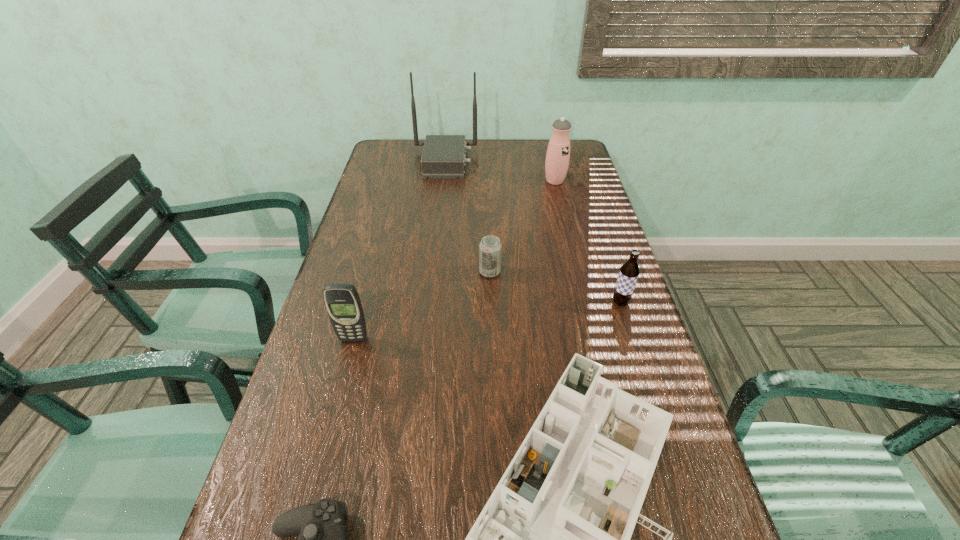
Find the location of a particular element. free space between the fourth nearest object and the second tallest object is located at coordinates (588, 242).

The height and width of the screenshot is (540, 960). What are the coordinates of `free point between the cellular telephone and the soda can` in the screenshot? It's located at (421, 306).

Where is `object that stands as the sixth closest to the router`? This screenshot has height=540, width=960. object that stands as the sixth closest to the router is located at coordinates (323, 539).

Image resolution: width=960 pixels, height=540 pixels. I want to click on object that is the second closest to the third farthest object, so click(553, 539).

The width and height of the screenshot is (960, 540). In order to click on vacant space that satisfies the following two spatial constraints: 1. on the back of the router to connect cables; 2. on the right side of the soda can in this screenshot , I will do `click(432, 272)`.

Identify the location of free region that satisfies the following two spatial constraints: 1. on the back of the fourth nearest object to connect cables; 2. on the left side of the router. (428, 302).

This screenshot has width=960, height=540. I want to click on vacant point that satisfies the following two spatial constraints: 1. on the back of the tallest object to connect cables; 2. on the right side of the third farthest object, so click(x=432, y=272).

Locate an element on the screen. The width and height of the screenshot is (960, 540). vacant region that satisfies the following two spatial constraints: 1. on the back of the tallest object to connect cables; 2. on the left side of the thermos bottle is located at coordinates (443, 181).